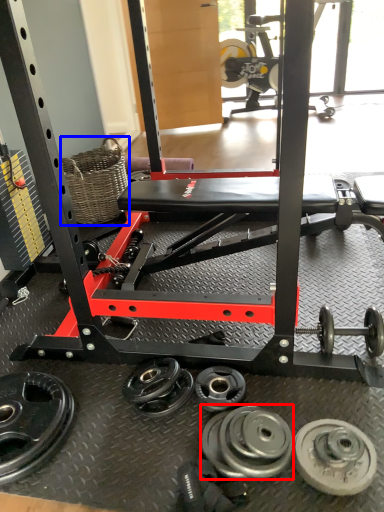
Question: Which point is further to the camera, wheel (highlighted by a red box) or basket (highlighted by a blue box)?

Choices:
 (A) wheel
 (B) basket

Answer: (B)